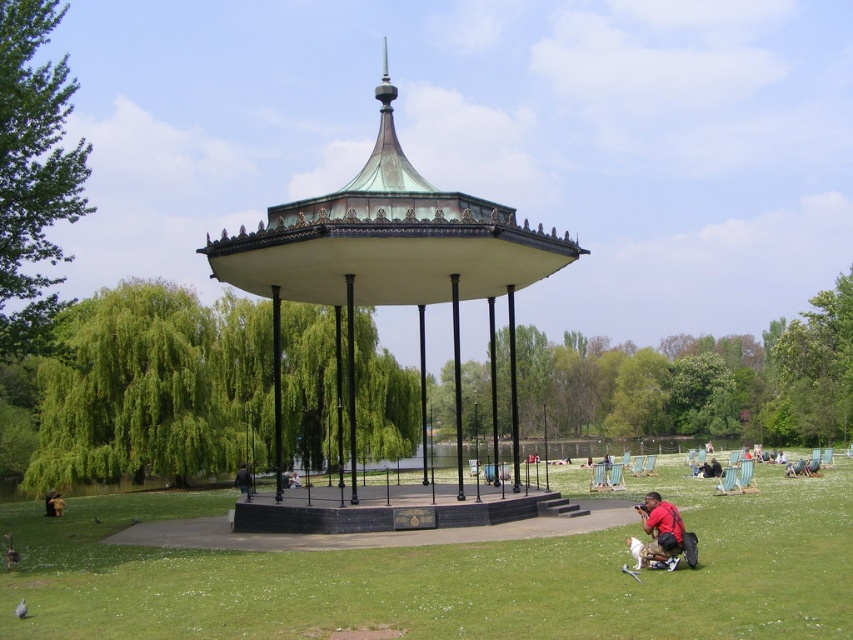
Question: Which object is farther from the camera taking this photo?

Choices:
 (A) green leafy tree at left
 (B) green grassy at center

Answer: (A)

Question: Which object is positioned farthest from the green leafy tree at left?

Choices:
 (A) bronze/golden gazebo at center
 (B) green grassy at center
 (C) green leafy tree at right

Answer: (C)

Question: Which point appears farthest from the camera in this image?

Choices:
 (A) (457, 333)
 (B) (793, 424)
 (C) (248, 484)

Answer: (B)

Question: Can you confirm if green leafy tree at left is positioned to the right of red backpack at lower right?

Choices:
 (A) yes
 (B) no

Answer: (B)

Question: Where is green leafy tree at center located in relation to bronze/golden gazebo at center in the image?

Choices:
 (A) left
 (B) right

Answer: (A)

Question: Does green leafy tree at center have a lesser width compared to green leafy tree at right?

Choices:
 (A) no
 (B) yes

Answer: (A)